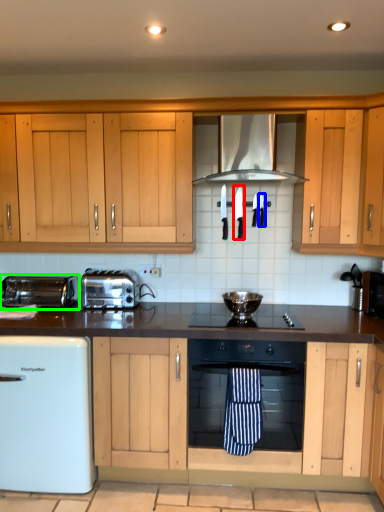
Question: Which is nearer to the appliance (highlighted by a red box)? appliance (highlighted by a blue box) or kitchen appliance (highlighted by a green box).

Choices:
 (A) appliance
 (B) kitchen appliance

Answer: (A)